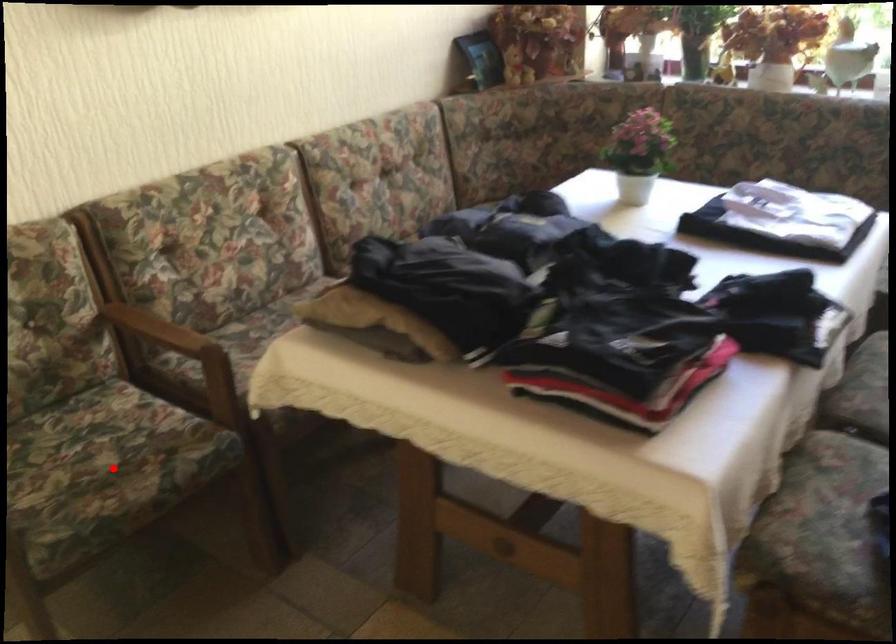
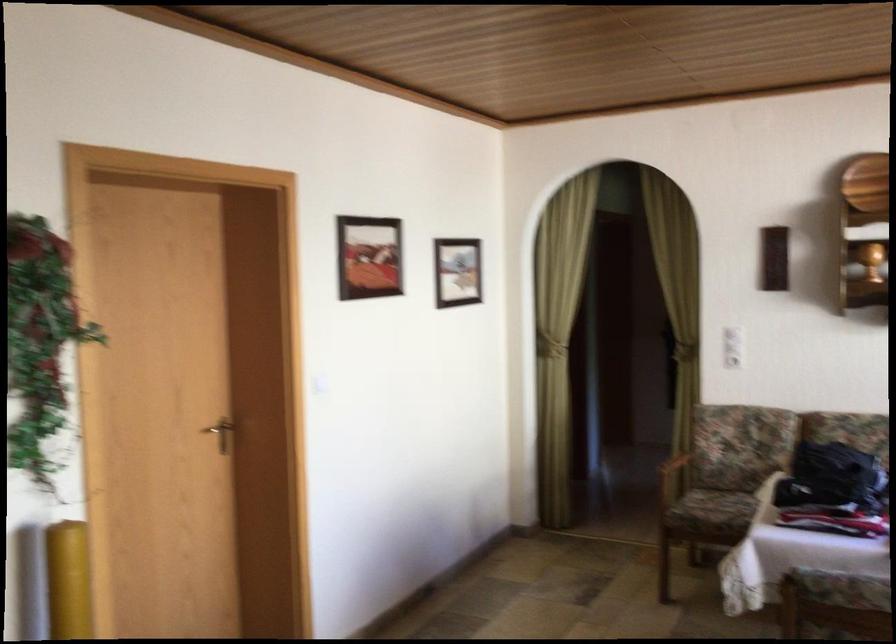
Question: I am providing you with two images of the same scene from different viewpoints. Image1 has a red point marked. In image2, the corresponding 3D location appears at what relative position? Reply with the corresponding letter.

Choices:
 (A) Closer
 (B) Farther

Answer: (B)